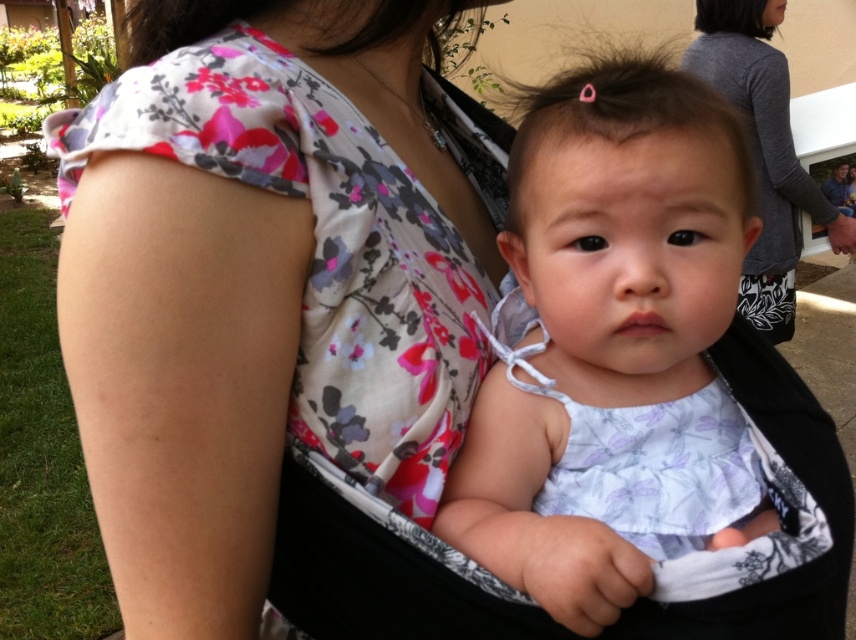
Describe the element at coordinates (611, 348) in the screenshot. I see `white floral dress at center` at that location.

Between point (595, 115) and point (770, 106), which one is positioned behind?

Positioned behind is point (770, 106).

Between point (625, 499) and point (728, 97), which one is positioned in front?

Point (625, 499)

This screenshot has height=640, width=856. I want to click on white floral dress at center, so click(x=611, y=348).